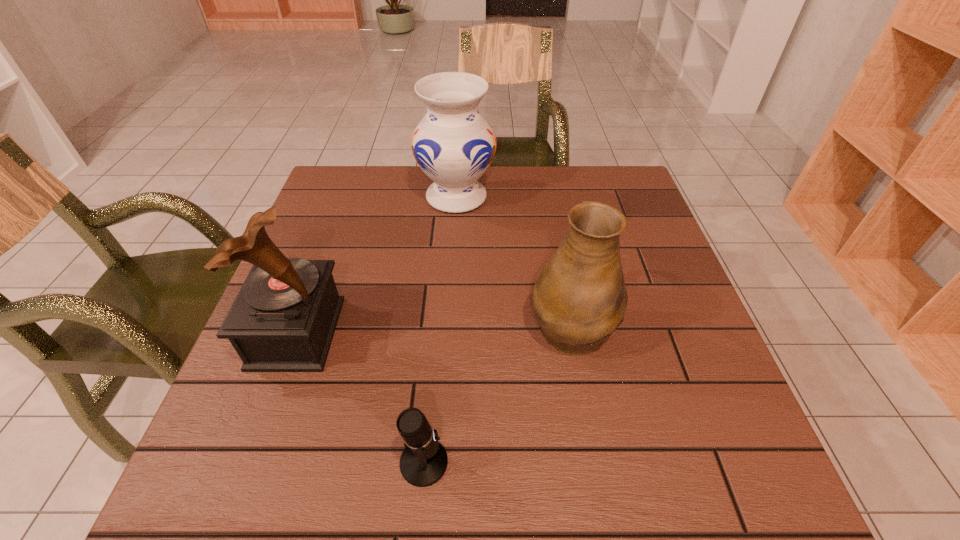
Locate an element on the screen. vase is located at coordinates (453, 144).

Locate an element on the screen. the leftmost object is located at coordinates (284, 317).

I want to click on pitcher, so click(580, 298).

In order to click on the nearest object in this screenshot , I will do `click(423, 462)`.

Locate an element on the screen. The width and height of the screenshot is (960, 540). the shortest object is located at coordinates (423, 462).

I want to click on vacant space situated on the front of the vase, so click(x=450, y=289).

The image size is (960, 540). Find the location of `free region located 0.170m at the horn opening of the phonograph_record`. free region located 0.170m at the horn opening of the phonograph_record is located at coordinates (419, 333).

Image resolution: width=960 pixels, height=540 pixels. What are the coordinates of `free space located 0.090m on the handle side of the rightmost object` in the screenshot? It's located at (560, 262).

The image size is (960, 540). In order to click on vacant area situated 0.100m on the handle side of the rightmost object in this screenshot , I will do `click(559, 260)`.

The image size is (960, 540). What are the coordinates of `vacant space located 0.350m on the handle side of the rightmost object` in the screenshot? It's located at (547, 199).